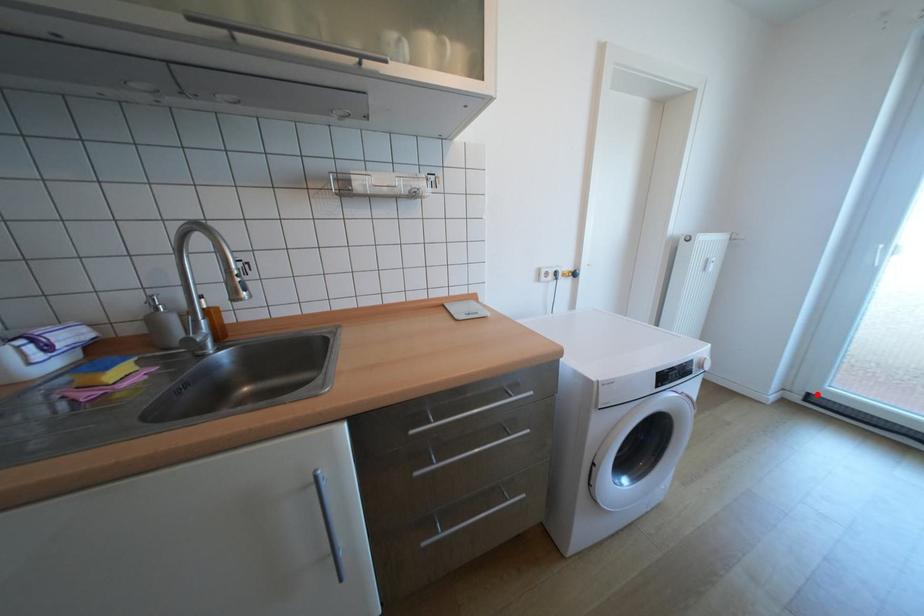
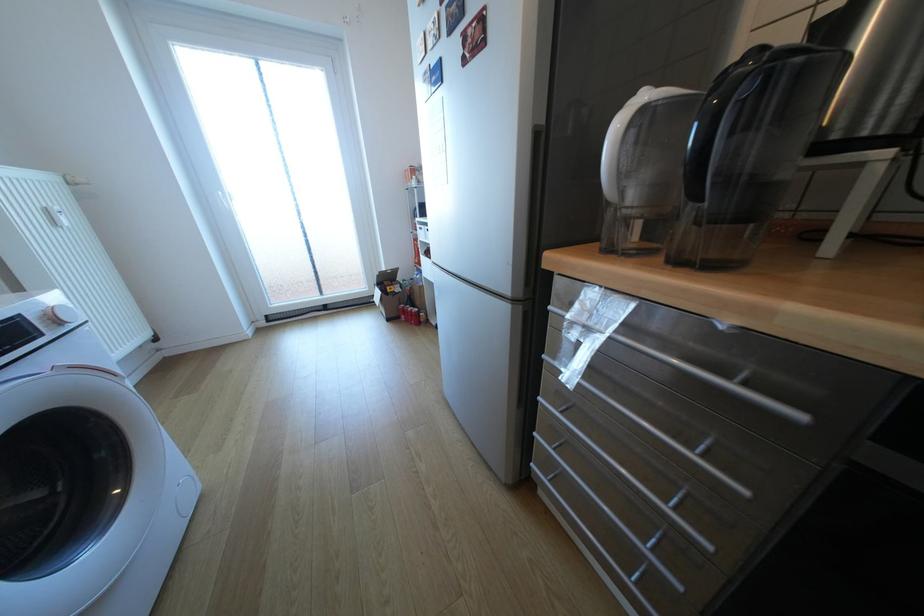
Where in the second image is the point corresponding to the highlighted location from the first image?

(275, 315)